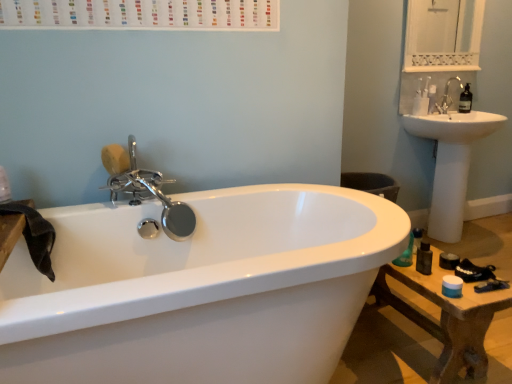
Question: From a real-world perspective, is polished chrome faucet at upper left, the second tap from the top, positioned over white matte toilet paper at upper right based on gravity?

Choices:
 (A) yes
 (B) no

Answer: (B)

Question: Is polished chrome faucet at upper left, arranged as the first tap when viewed from the front, positioned behind white matte toilet paper at upper right?

Choices:
 (A) no
 (B) yes

Answer: (A)

Question: Is polished chrome faucet at upper left, the first tap from the left, not within white matte toilet paper at upper right?

Choices:
 (A) yes
 (B) no

Answer: (A)

Question: From a real-world perspective, is polished chrome faucet at upper left, which is the second tap in back-to-front order, beneath white matte toilet paper at upper right?

Choices:
 (A) no
 (B) yes

Answer: (B)

Question: Considering the relative sizes of polished chrome faucet at upper left, arranged as the first tap when viewed from the front, and white matte toilet paper at upper right in the image provided, is polished chrome faucet at upper left, arranged as the first tap when viewed from the front, shorter than white matte toilet paper at upper right?

Choices:
 (A) no
 (B) yes

Answer: (A)

Question: Is satin nickel faucet at upper right, which ranks as the second tap in left-to-right order, spatially inside white glossy sink at upper right, or outside of it?

Choices:
 (A) inside
 (B) outside

Answer: (B)

Question: From a real-world perspective, is satin nickel faucet at upper right, which appears as the second tap when ordered from the bottom, above or below white glossy sink at upper right?

Choices:
 (A) below
 (B) above

Answer: (B)

Question: From the image's perspective, is satin nickel faucet at upper right, marked as the first tap in a top-to-bottom arrangement, positioned above or below white glossy sink at upper right?

Choices:
 (A) below
 (B) above

Answer: (B)

Question: Considering the positions of satin nickel faucet at upper right, marked as the 1th tap in a back-to-front arrangement, and white glossy sink at upper right in the image, is satin nickel faucet at upper right, marked as the 1th tap in a back-to-front arrangement, wider or thinner than white glossy sink at upper right?

Choices:
 (A) wide
 (B) thin

Answer: (B)

Question: Is white glossy sink at upper right inside or outside of wooden table at lower right?

Choices:
 (A) inside
 (B) outside

Answer: (B)

Question: Is white glossy sink at upper right in front of or behind wooden table at lower right in the image?

Choices:
 (A) behind
 (B) front

Answer: (A)

Question: Considering the positions of white glossy sink at upper right and wooden table at lower right in the image, is white glossy sink at upper right bigger or smaller than wooden table at lower right?

Choices:
 (A) big
 (B) small

Answer: (A)

Question: From the image's perspective, is white glossy sink at upper right located above or below wooden table at lower right?

Choices:
 (A) below
 (B) above

Answer: (B)

Question: Is white glossy medicine cabinet at upper right wider or thinner than white matte toilet paper at upper right?

Choices:
 (A) thin
 (B) wide

Answer: (A)

Question: Is white glossy medicine cabinet at upper right situated inside white matte toilet paper at upper right or outside?

Choices:
 (A) outside
 (B) inside

Answer: (A)